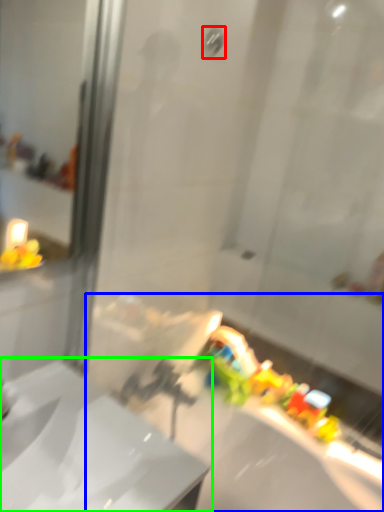
Question: Estimate the real-world distances between objects in this image. Which object is closer to shower (highlighted by a red box), bath (highlighted by a blue box) or sink (highlighted by a green box)?

Choices:
 (A) bath
 (B) sink

Answer: (B)